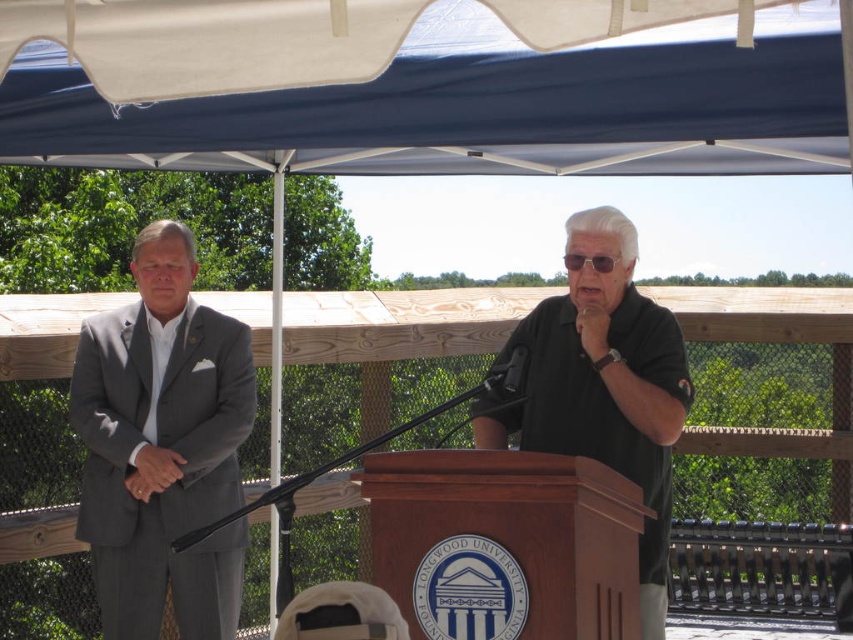
Question: Can you confirm if white fabric canopy at upper center is positioned above black matte shirt at center?

Choices:
 (A) no
 (B) yes

Answer: (B)

Question: Which point appears farthest from the camera in this image?

Choices:
 (A) (479, 106)
 (B) (515, 332)

Answer: (B)

Question: Is white fabric canopy at upper center in front of gray suit at left?

Choices:
 (A) no
 (B) yes

Answer: (A)

Question: Does white fabric canopy at upper center have a smaller size compared to black matte shirt at center?

Choices:
 (A) yes
 (B) no

Answer: (B)

Question: Among these points, which one is farthest from the camera?

Choices:
 (A) (698, 164)
 (B) (212, 577)

Answer: (A)

Question: Which of these objects is positioned closest to the black matte shirt at center?

Choices:
 (A) gray suit at left
 (B) white fabric canopy at upper center

Answer: (A)